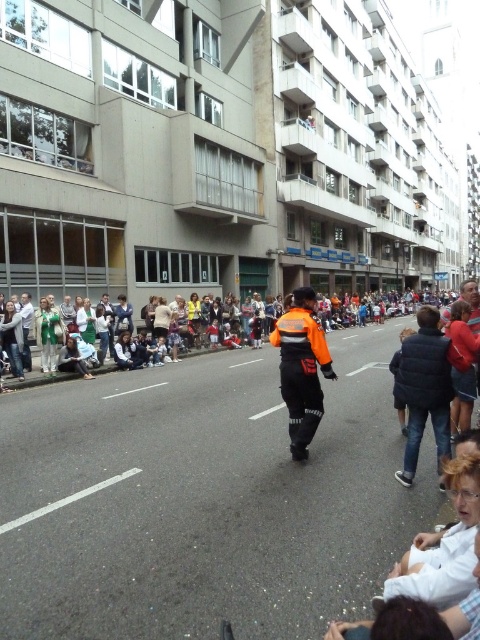
Is orange fabric jacket at center below orange reflective jacket at center?

Actually, orange fabric jacket at center is above orange reflective jacket at center.

Which is behind, point (279, 365) or point (470, 360)?

The point (279, 365) is more distant.

Which is in front, point (314, 352) or point (465, 323)?

Point (314, 352) is in front.

At what (x,y) coordinates should I click in order to perform the action: click on orange fabric jacket at center. Please return your answer as a coordinate pair (x, y). This screenshot has height=640, width=480. Looking at the image, I should click on (301, 369).

Which is in front, point (415, 340) or point (320, 385)?

Point (415, 340) is in front.

Who is positioned more to the right, black puffer jacket at lower right or orange fabric jacket at center?

black puffer jacket at lower right is more to the right.

In order to click on black puffer jacket at lower right in this screenshot , I will do `click(424, 388)`.

Based on the photo, who is taller, black puffer jacket at lower right or orange reflective jacket at center?

black puffer jacket at lower right is taller.

Looking at this image, between black puffer jacket at lower right and orange reflective jacket at center, which one appears on the left side from the viewer's perspective?

black puffer jacket at lower right

Who is more distant from viewer, [428,337] or [465,308]?

Answer: Positioned behind is point [465,308].

Where is `black puffer jacket at lower right`? This screenshot has height=640, width=480. black puffer jacket at lower right is located at coordinates (424, 388).